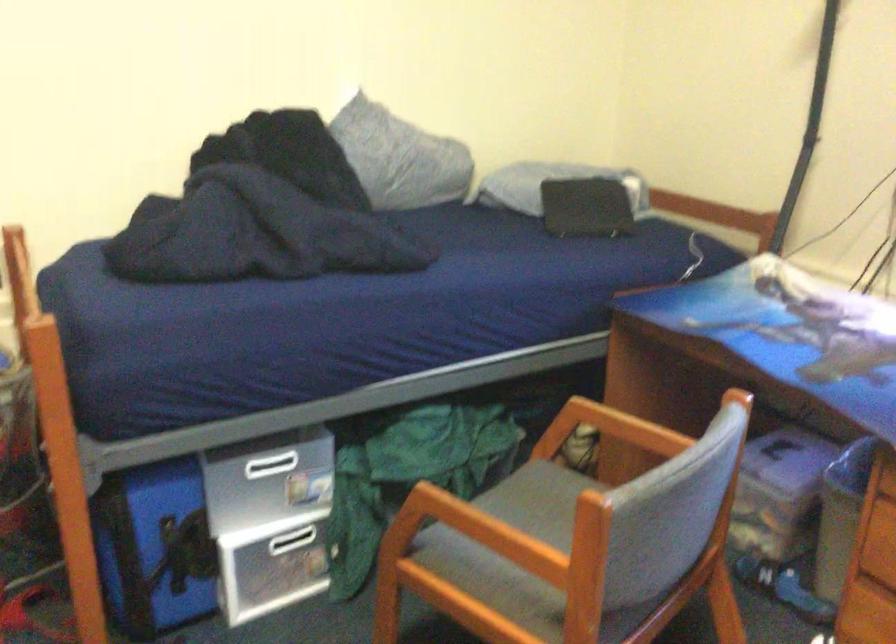
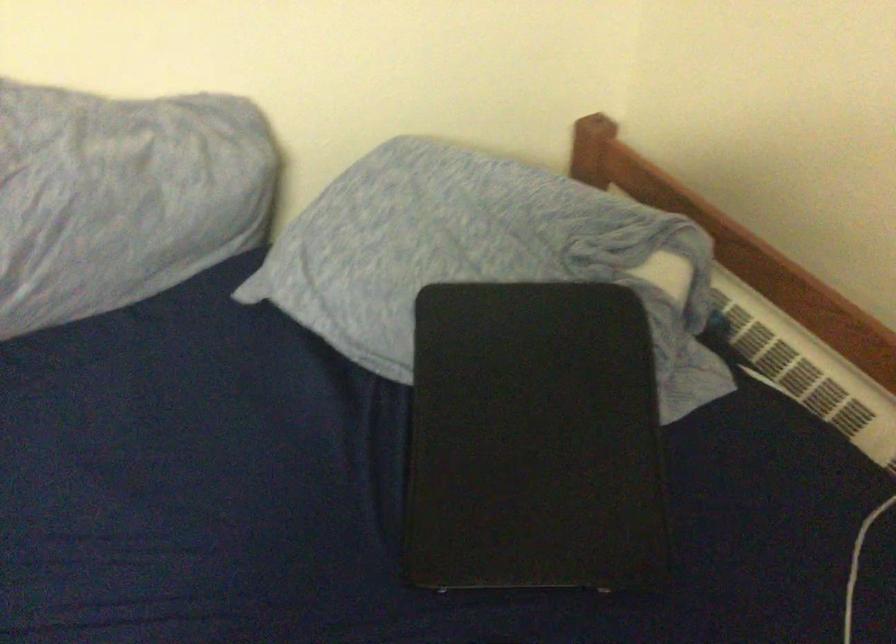
Question: The images are taken continuously from a first-person perspective. In which direction are you moving?

Choices:
 (A) Left
 (B) Right
 (C) Forward
 (D) Backward

Answer: (C)